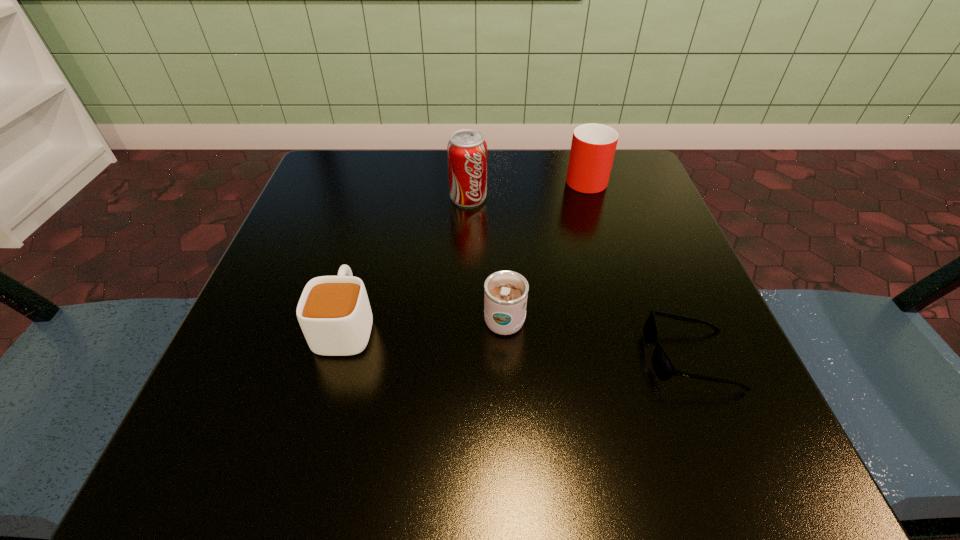
The image size is (960, 540). In order to click on the tallest object in this screenshot , I will do (467, 150).

Where is `the rightmost cup`? The image size is (960, 540). the rightmost cup is located at coordinates (593, 147).

At what (x,y) coordinates should I click in order to perform the action: click on the second cup from right to left. Please return your answer as a coordinate pair (x, y). Looking at the image, I should click on (505, 292).

Locate an element on the screen. This screenshot has width=960, height=540. the leftmost cup is located at coordinates (334, 313).

You are a GUI agent. You are given a task and a screenshot of the screen. Output one action in this format:
    pyautogui.click(x=<x>, y=<y>)
    Task: Click on the second shortest object
    The width and height of the screenshot is (960, 540).
    Given the screenshot: What is the action you would take?
    pyautogui.click(x=334, y=313)

At what (x,y) coordinates should I click in order to perform the action: click on the shortest object. Please return your answer as a coordinate pair (x, y). Image resolution: width=960 pixels, height=540 pixels. Looking at the image, I should click on (662, 365).

At what (x,y) coordinates should I click in order to perform the action: click on vacant region located on the left of the tallest object. Please return your answer as a coordinate pair (x, y). The height and width of the screenshot is (540, 960). Looking at the image, I should click on (324, 198).

Find the location of a particular element. Image resolution: width=960 pixels, height=540 pixels. free space located on the side with the handle of the second cup from right to left is located at coordinates (502, 273).

Find the location of a particular element. free space located on the side with the handle of the second cup from right to left is located at coordinates (496, 166).

Where is `free region located 0.090m on the side with the handle of the second cup from right to left`? Image resolution: width=960 pixels, height=540 pixels. free region located 0.090m on the side with the handle of the second cup from right to left is located at coordinates (501, 257).